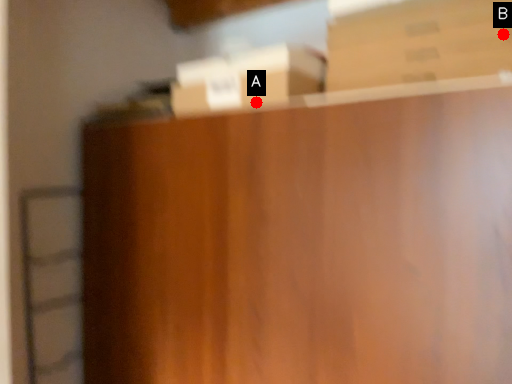
Question: Two points are circled on the image, labeled by A and B beside each circle. Which point is closer to the camera?

Choices:
 (A) A is closer
 (B) B is closer

Answer: (B)